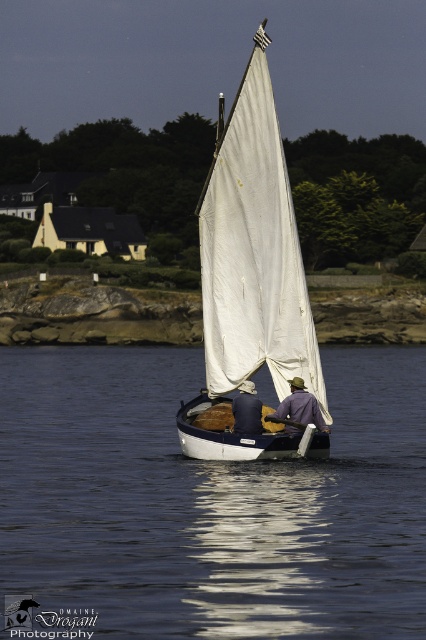
Question: Which is farther from the denim jacket at center?

Choices:
 (A) purple fabric at center
 (B) white sailboat at center
 (C) transparent blue water at center

Answer: (C)

Question: Is white canvas sailboat at center further to camera compared to denim jacket at center?

Choices:
 (A) yes
 (B) no

Answer: (B)

Question: Is white canvas sailboat at center wider than white sailboat at center?

Choices:
 (A) no
 (B) yes

Answer: (B)

Question: Among these objects, which one is nearest to the camera?

Choices:
 (A) white canvas sailboat at center
 (B) transparent blue water at center

Answer: (B)

Question: Which point is closer to the camera?

Choices:
 (A) (253, 417)
 (B) (264, 227)

Answer: (B)

Question: Does purple fabric at center appear under denim jacket at center?

Choices:
 (A) yes
 (B) no

Answer: (A)